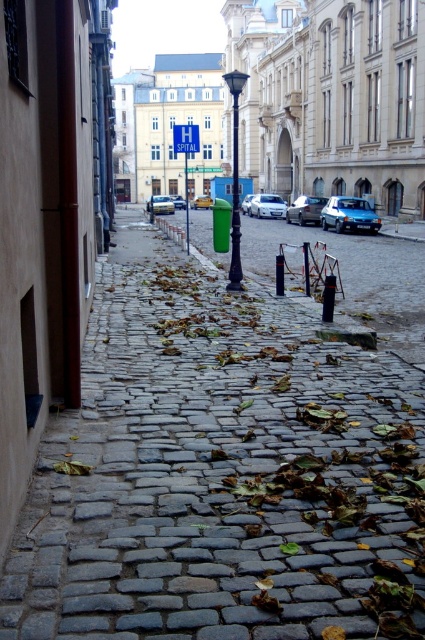
Question: Estimate the real-world distances between objects in this image. Which object is farther from the matte white car at center?

Choices:
 (A) green plastic pole at center
 (B) polished metal lamp post at center
 (C) shiny silver sedan at center

Answer: (A)

Question: Which point is farther from the camera taking this photo?

Choices:
 (A) (235, 189)
 (B) (198, 202)

Answer: (B)

Question: In this image, where is metallic silver hatchback at center located relative to green plastic pole at center?

Choices:
 (A) above
 (B) below

Answer: (B)

Question: Which object is farther from the camera taking this photo?

Choices:
 (A) polished metal lamp post at center
 (B) matte white car at center
 (C) shiny silver sedan at center
 (D) silver metallic car at center

Answer: (D)

Question: Considering the relative positions of polished metal lamp post at center and shiny silver sedan at center in the image provided, where is polished metal lamp post at center located with respect to shiny silver sedan at center?

Choices:
 (A) right
 (B) left

Answer: (B)

Question: Is cobblestone pavement at center bigger than metallic silver car at center?

Choices:
 (A) no
 (B) yes

Answer: (A)